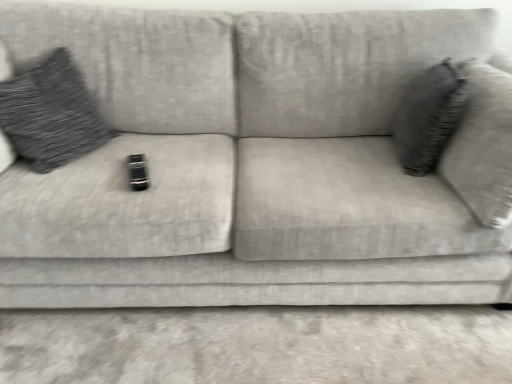
The height and width of the screenshot is (384, 512). I want to click on textured gray pillow at right, acting as the first throw pillow starting from the right, so click(x=428, y=117).

What do you see at coordinates (428, 117) in the screenshot?
I see `textured gray pillow at right, acting as the first throw pillow starting from the right` at bounding box center [428, 117].

Measure the distance between point (13, 114) and camera.

Point (13, 114) is 4.43 feet away from camera.

You are a GUI agent. You are given a task and a screenshot of the screen. Output one action in this format:
    pyautogui.click(x=<x>, y=<y>)
    Task: Click on the textured gray pillow at left, which is the second throw pillow in right-to-left order
    The image size is (512, 384).
    Given the screenshot: What is the action you would take?
    pyautogui.click(x=51, y=114)

The width and height of the screenshot is (512, 384). Describe the element at coordinates (51, 114) in the screenshot. I see `textured gray pillow at left, which appears as the 1th throw pillow when viewed from the left` at that location.

The height and width of the screenshot is (384, 512). Identify the location of textured gray pillow at right, acting as the first throw pillow starting from the right. (428, 117).

Based on the photo, is textured gray pillow at left, which is the second throw pillow in right-to-left order, at the left side of textured gray pillow at right, acting as the first throw pillow starting from the right?

Yes.

Which object is closer to the camera taking this photo, textured gray pillow at left, which is the second throw pillow in right-to-left order, or textured gray pillow at right, acting as the first throw pillow starting from the right?

textured gray pillow at left, which is the second throw pillow in right-to-left order, is in front.

Which is further, (0, 109) or (445, 92)?

Point (0, 109)

From the image's perspective, is textured gray pillow at left, which appears as the 1th throw pillow when viewed from the left, beneath textured gray pillow at right, acting as the first throw pillow starting from the right?

Incorrect, from the image's perspective, textured gray pillow at left, which appears as the 1th throw pillow when viewed from the left, is higher than textured gray pillow at right, acting as the first throw pillow starting from the right.

From the picture: From a real-world perspective, does textured gray pillow at left, which is the second throw pillow in right-to-left order, sit lower than textured gray pillow at right, placed as the second throw pillow when sorted from left to right?

Yes, from a real-world perspective, textured gray pillow at left, which is the second throw pillow in right-to-left order, is below textured gray pillow at right, placed as the second throw pillow when sorted from left to right.

Which object is thinner, textured gray pillow at left, which is the second throw pillow in right-to-left order, or textured gray pillow at right, acting as the first throw pillow starting from the right?

With smaller width is textured gray pillow at right, acting as the first throw pillow starting from the right.

Can you confirm if textured gray pillow at left, which is the second throw pillow in right-to-left order, is shorter than textured gray pillow at right, acting as the first throw pillow starting from the right?

Incorrect, the height of textured gray pillow at left, which is the second throw pillow in right-to-left order, does not fall short of that of textured gray pillow at right, acting as the first throw pillow starting from the right.

Considering the sizes of objects textured gray pillow at left, which appears as the 1th throw pillow when viewed from the left, and textured gray pillow at right, placed as the second throw pillow when sorted from left to right, in the image provided, who is bigger, textured gray pillow at left, which appears as the 1th throw pillow when viewed from the left, or textured gray pillow at right, placed as the second throw pillow when sorted from left to right,?

Bigger between the two is textured gray pillow at left, which appears as the 1th throw pillow when viewed from the left.

Would you say textured gray pillow at left, which is the second throw pillow in right-to-left order, is outside textured gray pillow at right, placed as the second throw pillow when sorted from left to right?

Yes, textured gray pillow at left, which is the second throw pillow in right-to-left order, is outside of textured gray pillow at right, placed as the second throw pillow when sorted from left to right.

Is textured gray pillow at left, which appears as the 1th throw pillow when viewed from the left, with textured gray pillow at right, placed as the second throw pillow when sorted from left to right?

No, textured gray pillow at left, which appears as the 1th throw pillow when viewed from the left, is not next to textured gray pillow at right, placed as the second throw pillow when sorted from left to right.

Is textured gray pillow at left, which appears as the 1th throw pillow when viewed from the left, facing towards textured gray pillow at right, acting as the first throw pillow starting from the right?

Yes, textured gray pillow at left, which appears as the 1th throw pillow when viewed from the left, is aimed at textured gray pillow at right, acting as the first throw pillow starting from the right.

How different are the orientations of textured gray pillow at left, which is the second throw pillow in right-to-left order, and textured gray pillow at right, acting as the first throw pillow starting from the right, in degrees?

The facing directions of textured gray pillow at left, which is the second throw pillow in right-to-left order, and textured gray pillow at right, acting as the first throw pillow starting from the right, are 162 degrees apart.

Find the location of a particular element. The width and height of the screenshot is (512, 384). throw pillow that appears below the textured gray pillow at right, placed as the second throw pillow when sorted from left to right (from a real-world perspective) is located at coordinates (51, 114).

In the scene shown: Can you confirm if textured gray pillow at right, placed as the second throw pillow when sorted from left to right, is positioned to the right of textured gray pillow at left, which is the second throw pillow in right-to-left order?

Yes, textured gray pillow at right, placed as the second throw pillow when sorted from left to right, is to the right of textured gray pillow at left, which is the second throw pillow in right-to-left order.

Considering the positions of objects textured gray pillow at right, placed as the second throw pillow when sorted from left to right, and textured gray pillow at left, which is the second throw pillow in right-to-left order, in the image provided, who is in front, textured gray pillow at right, placed as the second throw pillow when sorted from left to right, or textured gray pillow at left, which is the second throw pillow in right-to-left order,?

textured gray pillow at left, which is the second throw pillow in right-to-left order, is closer to the camera.

Which is further, (435,114) or (34,105)?

Positioned behind is point (34,105).

From the image's perspective, is textured gray pillow at right, acting as the first throw pillow starting from the right, under textured gray pillow at left, which appears as the 1th throw pillow when viewed from the left?

Yes, from the image's perspective, textured gray pillow at right, acting as the first throw pillow starting from the right, is below textured gray pillow at left, which appears as the 1th throw pillow when viewed from the left.

From a real-world perspective, is textured gray pillow at right, placed as the second throw pillow when sorted from left to right, located beneath textured gray pillow at left, which is the second throw pillow in right-to-left order?

No, from a real-world perspective, textured gray pillow at right, placed as the second throw pillow when sorted from left to right, is not below textured gray pillow at left, which is the second throw pillow in right-to-left order.

Which object is thinner, textured gray pillow at right, placed as the second throw pillow when sorted from left to right, or textured gray pillow at left, which appears as the 1th throw pillow when viewed from the left?

With smaller width is textured gray pillow at right, placed as the second throw pillow when sorted from left to right.

In terms of height, does textured gray pillow at right, placed as the second throw pillow when sorted from left to right, look taller or shorter compared to textured gray pillow at left, which appears as the 1th throw pillow when viewed from the left?

Considering their sizes, textured gray pillow at right, placed as the second throw pillow when sorted from left to right, has less height than textured gray pillow at left, which appears as the 1th throw pillow when viewed from the left.

Considering the sizes of objects textured gray pillow at right, placed as the second throw pillow when sorted from left to right, and textured gray pillow at left, which is the second throw pillow in right-to-left order, in the image provided, who is bigger, textured gray pillow at right, placed as the second throw pillow when sorted from left to right, or textured gray pillow at left, which is the second throw pillow in right-to-left order,?

textured gray pillow at left, which is the second throw pillow in right-to-left order, is bigger.

Would you say textured gray pillow at left, which appears as the 1th throw pillow when viewed from the left, is part of textured gray pillow at right, placed as the second throw pillow when sorted from left to right,'s contents?

No, textured gray pillow at left, which appears as the 1th throw pillow when viewed from the left, is located outside of textured gray pillow at right, placed as the second throw pillow when sorted from left to right.

Can you see textured gray pillow at right, placed as the second throw pillow when sorted from left to right, touching textured gray pillow at left, which is the second throw pillow in right-to-left order?

textured gray pillow at right, placed as the second throw pillow when sorted from left to right, is not next to textured gray pillow at left, which is the second throw pillow in right-to-left order, and they're not touching.

Could you tell me if textured gray pillow at right, placed as the second throw pillow when sorted from left to right, is turned towards textured gray pillow at left, which appears as the 1th throw pillow when viewed from the left?

Yes, textured gray pillow at right, placed as the second throw pillow when sorted from left to right, is oriented towards textured gray pillow at left, which appears as the 1th throw pillow when viewed from the left.

Identify the location of throw pillow in front of the textured gray pillow at right, acting as the first throw pillow starting from the right. (51, 114).

At what (x,y) coordinates should I click in order to perform the action: click on throw pillow located behind the textured gray pillow at left, which is the second throw pillow in right-to-left order. Please return your answer as a coordinate pair (x, y). This screenshot has height=384, width=512. Looking at the image, I should click on (428, 117).

Where is `throw pillow below the textured gray pillow at right, acting as the first throw pillow starting from the right (from a real-world perspective)`? The height and width of the screenshot is (384, 512). throw pillow below the textured gray pillow at right, acting as the first throw pillow starting from the right (from a real-world perspective) is located at coordinates (51, 114).